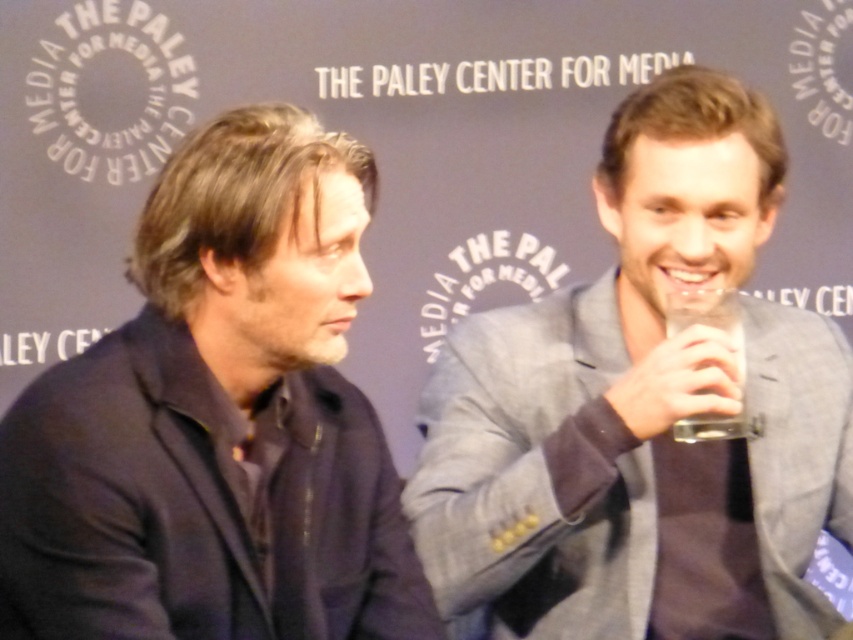
Question: Based on their relative distances, which object is farther from the dark blue fabric at left?

Choices:
 (A) clear glass cup at right
 (B) gray fabric suit at right

Answer: (A)

Question: Is dark blue fabric at left smaller than clear glass cup at right?

Choices:
 (A) yes
 (B) no

Answer: (B)

Question: Which point appears closest to the camera in this image?

Choices:
 (A) (341, 156)
 (B) (631, 541)

Answer: (A)

Question: Can you confirm if dark blue fabric at left is positioned below clear glass cup at right?

Choices:
 (A) no
 (B) yes

Answer: (A)

Question: Estimate the real-world distances between objects in this image. Which object is closer to the dark blue fabric at left?

Choices:
 (A) gray fabric suit at right
 (B) clear glass cup at right

Answer: (A)

Question: Can you confirm if dark blue fabric at left is thinner than clear glass cup at right?

Choices:
 (A) yes
 (B) no

Answer: (B)